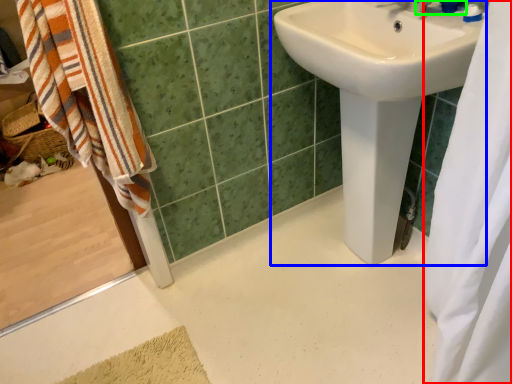
Question: Based on their relative distances, which object is nearer to shower curtain (highlighted by a red box)? Choose from sink (highlighted by a blue box) and plumbing fixture (highlighted by a green box).

Choices:
 (A) sink
 (B) plumbing fixture

Answer: (A)